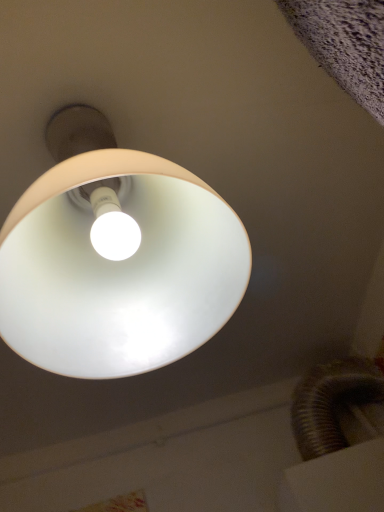
Question: Should I look upward or downward to see matte white lampshade at upper center?

Choices:
 (A) down
 (B) up

Answer: (B)